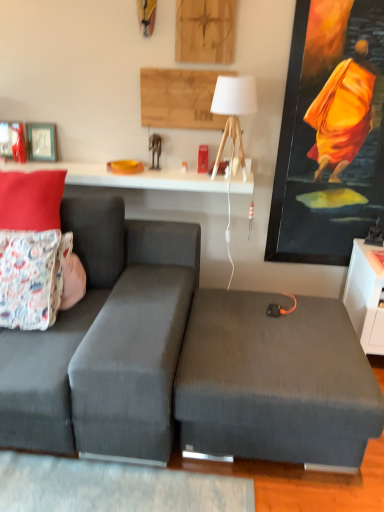
Question: From a real-world perspective, is dark gray fabric couch at left positioned over matte fabric pillow at upper left, positioned as the 2th pillow in bottom-to-top order, based on gravity?

Choices:
 (A) yes
 (B) no

Answer: (B)

Question: Is dark gray fabric couch at left oriented away from matte fabric pillow at upper left, positioned as the 2th pillow in bottom-to-top order?

Choices:
 (A) no
 (B) yes

Answer: (A)

Question: Is dark gray fabric couch at left positioned in front of matte fabric pillow at upper left, the 1th pillow when ordered from top to bottom?

Choices:
 (A) no
 (B) yes

Answer: (B)

Question: Is dark gray fabric couch at left at the right side of matte fabric pillow at upper left, the 1th pillow when ordered from top to bottom?

Choices:
 (A) no
 (B) yes

Answer: (B)

Question: Does dark gray fabric couch at left have a greater height compared to matte fabric pillow at upper left, the 1th pillow when ordered from top to bottom?

Choices:
 (A) no
 (B) yes

Answer: (B)

Question: From the image's perspective, is matte black picture frame at upper left, which ranks as the 1th picture frame in left-to-right order, located above or below dark gray fabric couch at left?

Choices:
 (A) below
 (B) above

Answer: (B)

Question: Does point (14, 141) appear closer or farther from the camera than point (162, 326)?

Choices:
 (A) farther
 (B) closer

Answer: (A)

Question: Is matte black picture frame at upper left, which ranks as the 1th picture frame in left-to-right order, to the left or to the right of dark gray fabric couch at left in the image?

Choices:
 (A) left
 (B) right

Answer: (A)

Question: In terms of height, does matte black picture frame at upper left, which ranks as the 1th picture frame in left-to-right order, look taller or shorter compared to dark gray fabric couch at left?

Choices:
 (A) short
 (B) tall

Answer: (A)

Question: Visually, is dark gray fabric ottoman at center positioned to the left or to the right of matte black picture frame at upper left, which is the second picture frame in right-to-left order?

Choices:
 (A) right
 (B) left

Answer: (A)

Question: Looking at the image, does dark gray fabric ottoman at center seem bigger or smaller compared to matte black picture frame at upper left, which is the second picture frame in right-to-left order?

Choices:
 (A) big
 (B) small

Answer: (A)

Question: Relative to matte black picture frame at upper left, which is the second picture frame in right-to-left order, is dark gray fabric ottoman at center in front or behind?

Choices:
 (A) behind
 (B) front

Answer: (B)

Question: Does point (264, 415) appear closer or farther from the camera than point (11, 135)?

Choices:
 (A) closer
 (B) farther

Answer: (A)

Question: From the image's perspective, is dark gray fabric couch at left above or below dark gray fabric ottoman at center?

Choices:
 (A) below
 (B) above

Answer: (B)

Question: From a real-world perspective, is dark gray fabric couch at left positioned above or below dark gray fabric ottoman at center?

Choices:
 (A) above
 (B) below

Answer: (A)